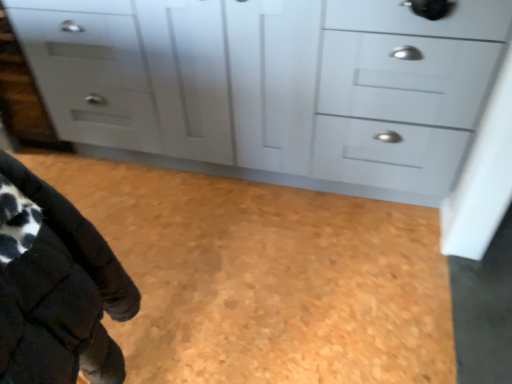
Question: Should I look upward or downward to see matte white cabinet at center?

Choices:
 (A) down
 (B) up

Answer: (B)